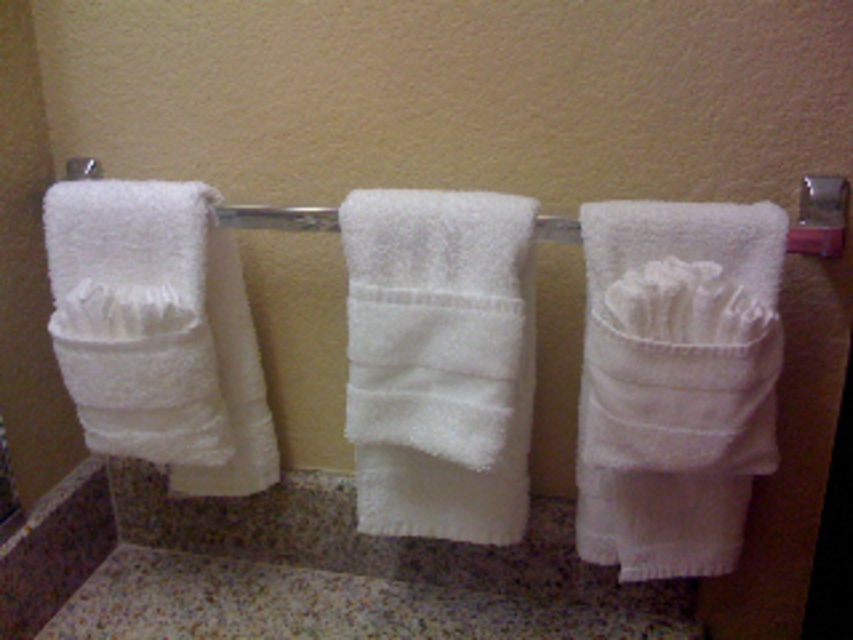
Does white soft towel at right appear under white fluffy towel at center?

Correct, white soft towel at right is located below white fluffy towel at center.

Can you confirm if white soft towel at right is wider than white fluffy towel at center?

Indeed, white soft towel at right has a greater width compared to white fluffy towel at center.

Locate an element on the screen. white soft towel at right is located at coordinates (675, 381).